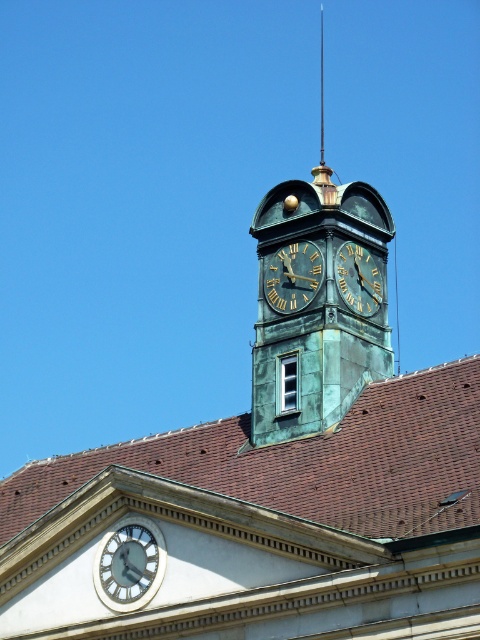
Question: Which object is the farthest from the bronze clock at center?

Choices:
 (A) goldmaterial/textureclock at upper center
 (B) brown tile roof at center

Answer: (B)

Question: Does green patina clock tower at center come behind bronze clock at center?

Choices:
 (A) no
 (B) yes

Answer: (A)

Question: Can you confirm if green patina clock tower at center is positioned to the right of polished brass spire at center?

Choices:
 (A) no
 (B) yes

Answer: (A)

Question: Among these points, which one is nearest to the camera?

Choices:
 (A) (362, 342)
 (B) (121, 548)

Answer: (B)

Question: Is goldmaterial/textureclock at upper center bigger than polished brass spire at center?

Choices:
 (A) no
 (B) yes

Answer: (A)

Question: Which point is closer to the camera taking this photo?

Choices:
 (A) (312, 252)
 (B) (149, 580)
 (C) (283, 294)
 (D) (360, 282)

Answer: (B)